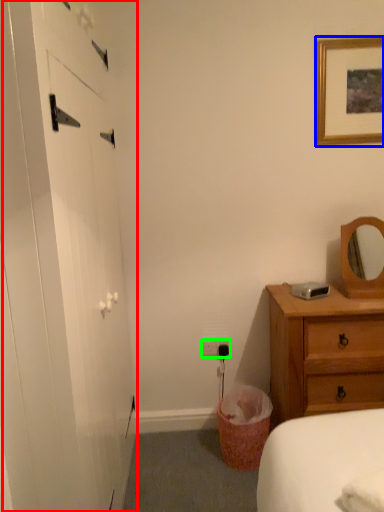
Question: Estimate the real-world distances between objects in this image. Which object is farther from barn door (highlighted by a red box), picture frame (highlighted by a blue box) or electric outlet (highlighted by a green box)?

Choices:
 (A) picture frame
 (B) electric outlet

Answer: (A)